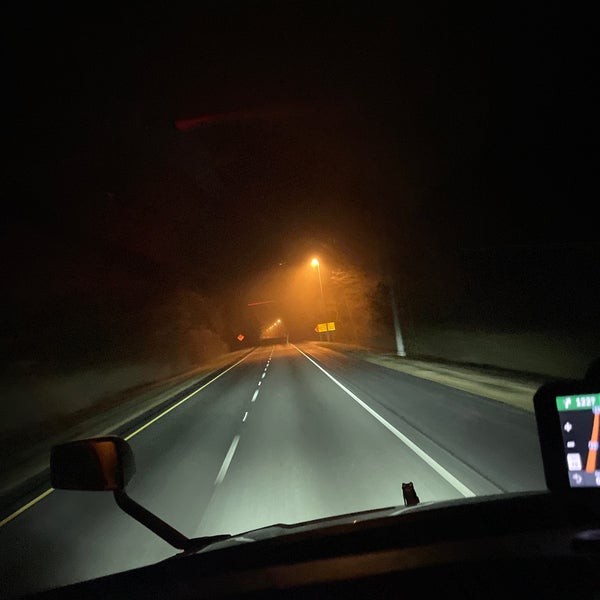
This screenshot has width=600, height=600. What are the coordinates of `mirror` in the screenshot? It's located at (116, 468).